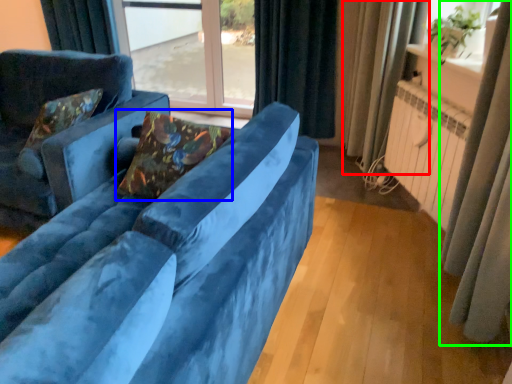
Question: Which object is the closest to the curtain (highlighted by a red box)? Choose among these: pillow (highlighted by a blue box) or curtain (highlighted by a green box).

Choices:
 (A) pillow
 (B) curtain

Answer: (B)